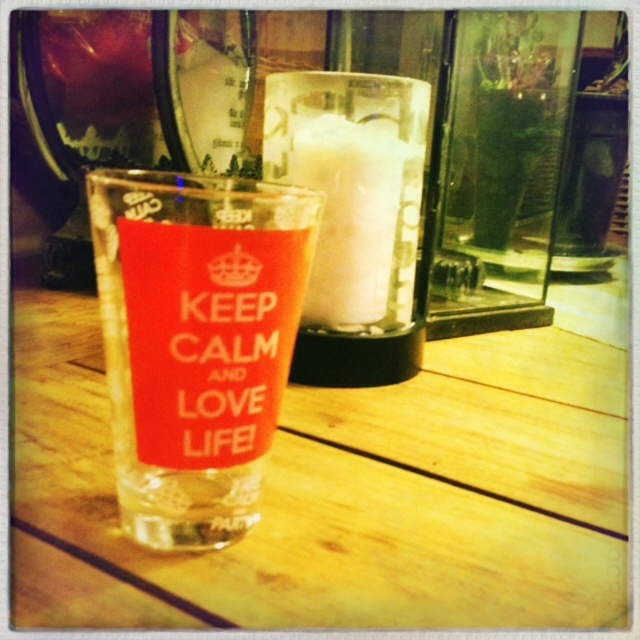
You are taking a photo of the two points on the table. Which point, point (116, 340) or point (225, 465), will appear larger in your photo?

Point (116, 340) will appear larger in the photo because it is closer to the camera than point (225, 465).

Looking at this image, you are arranging items on a table for a party. You have a white frothy milk at center and a matte orange sign at center. If you want to place them side by side without overlapping, which item should be placed first to accommodate their widths?

The white frothy milk at center should be placed first since its width is greater than the matte orange sign at center, ensuring there is enough space for both items when placed side by side.